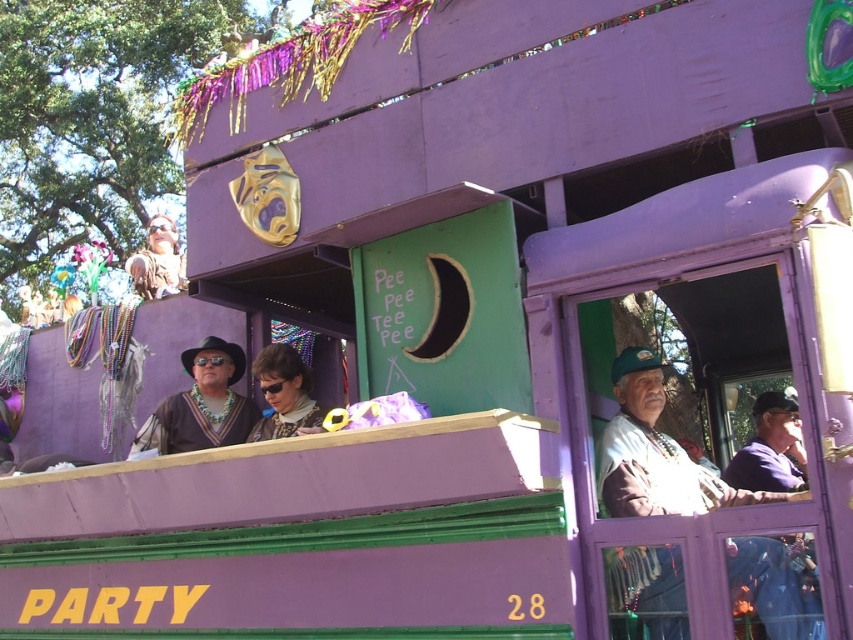
Question: Is matte brown hat at center below matte brown leather jacket at upper left?

Choices:
 (A) yes
 (B) no

Answer: (A)

Question: Does white fabric coach at right come in front of matte black sunglasses at center?

Choices:
 (A) no
 (B) yes

Answer: (B)

Question: Which of the following is the closest to the observer?

Choices:
 (A) white fabric coach at right
 (B) matte black sunglasses at center

Answer: (A)

Question: Which object is positioned closest to the matte brown leather jacket at upper left?

Choices:
 (A) matte black sunglasses at center
 (B) matte brown hat at center
 (C) white fabric coach at right

Answer: (B)

Question: Estimate the real-world distances between objects in this image. Which object is farther from the matte brown leather jacket at upper left?

Choices:
 (A) white fabric coach at right
 (B) matte brown hat at center

Answer: (A)

Question: Is white fabric coach at right smaller than matte brown hat at center?

Choices:
 (A) yes
 (B) no

Answer: (B)